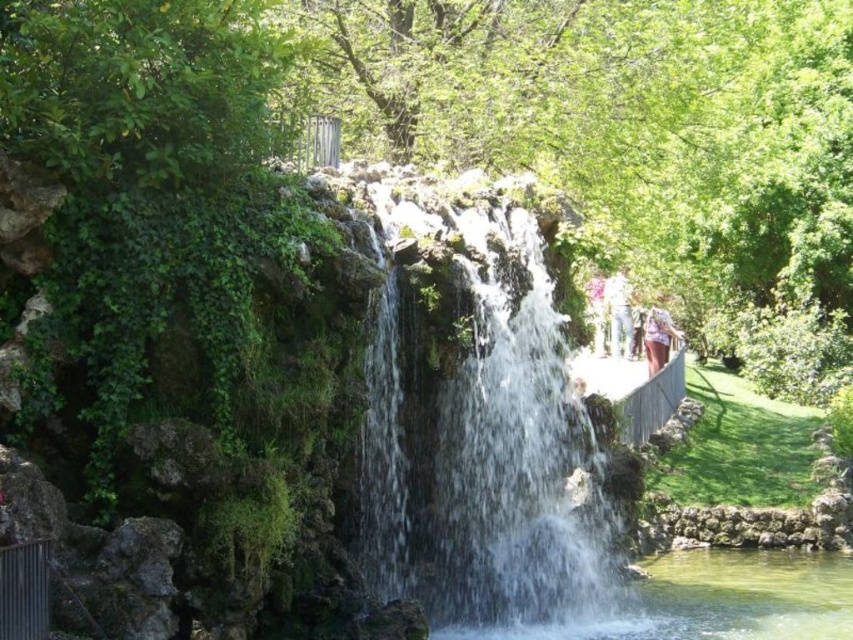
Can you confirm if clear water at center is thinner than white fabric at right?

No, clear water at center is not thinner than white fabric at right.

Is clear water at center positioned at the back of white fabric at right?

No, it is not.

Looking at this image, measure the distance between point (463, 580) and camera.

A distance of 116.09 feet exists between point (463, 580) and camera.

Where is `clear water at center`? clear water at center is located at coordinates (488, 452).

Is clear glass pond at center bigger than pink fabric at center?

No, clear glass pond at center is not bigger than pink fabric at center.

Can you confirm if clear glass pond at center is shorter than pink fabric at center?

Indeed, clear glass pond at center has a lesser height compared to pink fabric at center.

Does point (595, 628) come farther from viewer compared to point (599, 296)?

No, (595, 628) is in front of (599, 296).

Identify the location of clear glass pond at center. (711, 600).

Is point (647, 349) positioned before point (598, 323)?

That is True.

Based on the photo, which is more to the right, light purple fabric at center-right or pink fabric at center?

Positioned to the right is light purple fabric at center-right.

Does point (650, 346) come in front of point (598, 349)?

Yes, point (650, 346) is closer to viewer.

This screenshot has width=853, height=640. I want to click on light purple fabric at center-right, so click(x=659, y=336).